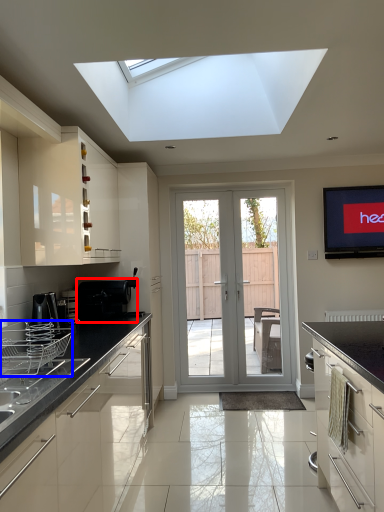
Question: Which of the following is the farthest to the observer, appliance (highlighted by a red box) or appliance (highlighted by a blue box)?

Choices:
 (A) appliance
 (B) appliance

Answer: (A)